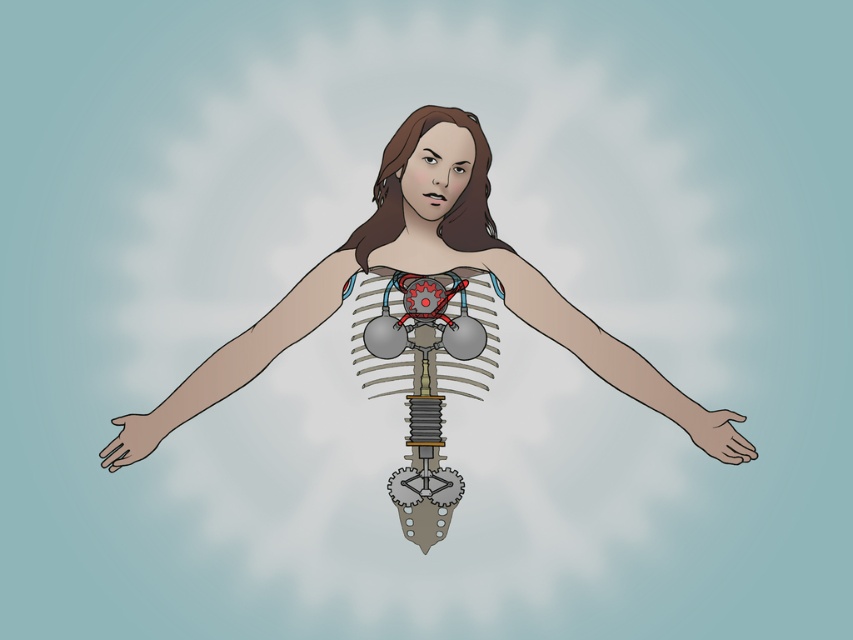
You are an animator designing this character. You need to ensure that the smooth skin arm at left and the matte brown hand at lower right are proportionate. Which object should you adjust to make them match in size?

The smooth skin arm at left is bigger than the matte brown hand at lower right. To make them match in size, you should reduce the size of the smooth skin arm at left or increase the size of the matte brown hand at lower right.

You are an artist analyzing the figure in the image. The smooth skin arm at left and the matte gray hand at lower left are part of the character. Which object is bigger in terms of size?

The smooth skin arm at left is larger in size than the matte gray hand at lower left.

You are an animator working on a character design. You need to place a glowing gemstone on the point at coordinates point (715, 433). Based on the scene description, where exactly on the character should you place this gemstone?

The point (715, 433) is located on the matte brown hand at lower right, so you should place the glowing gemstone on the matte brown hand at lower right.